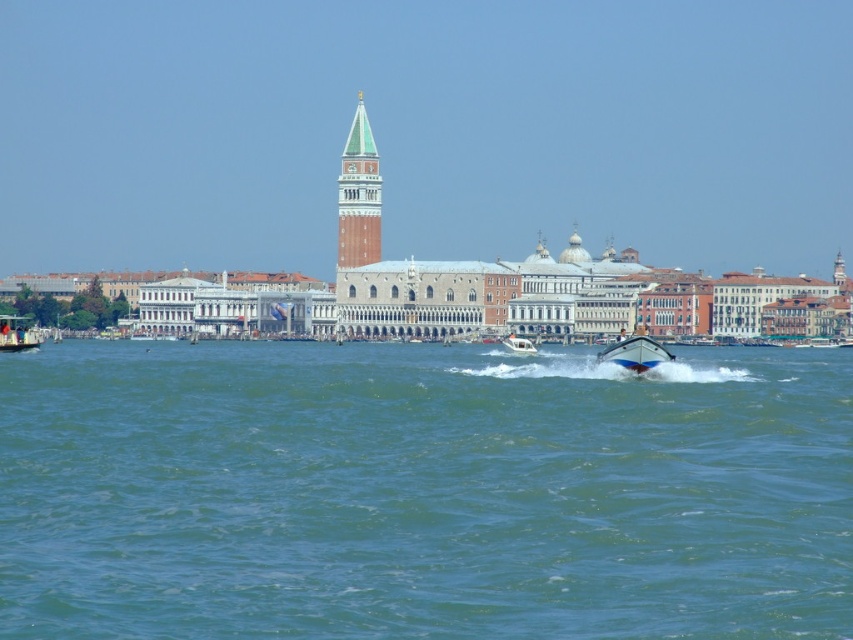
Question: In this image, where is green marble tower at center located relative to blue glossy motorboat at center?

Choices:
 (A) above
 (B) below

Answer: (A)

Question: Is green water at center to the right of blue glossy motorboat at center from the viewer's perspective?

Choices:
 (A) no
 (B) yes

Answer: (A)

Question: Can you confirm if green water at center is smaller than green marble tower at center?

Choices:
 (A) no
 (B) yes

Answer: (A)

Question: Estimate the real-world distances between objects in this image. Which object is closer to the metallic silver boat at lower left?

Choices:
 (A) green marble tower at center
 (B) green water at center
 (C) blue glossy motorboat at center

Answer: (A)

Question: Which object is the farthest from the blue glossy motorboat at center?

Choices:
 (A) green marble tower at center
 (B) green water at center
 (C) metallic silver boat at lower left
 (D) white glossy motorboat at center

Answer: (C)

Question: Which object is positioned farthest from the green marble tower at center?

Choices:
 (A) green water at center
 (B) white glossy motorboat at center
 (C) blue glossy motorboat at center
 (D) metallic silver boat at lower left

Answer: (A)